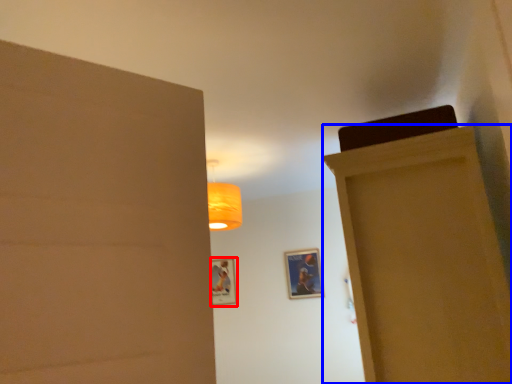
Question: Which point is further to the camera, picture frame (highlighted by a red box) or door (highlighted by a blue box)?

Choices:
 (A) picture frame
 (B) door

Answer: (A)